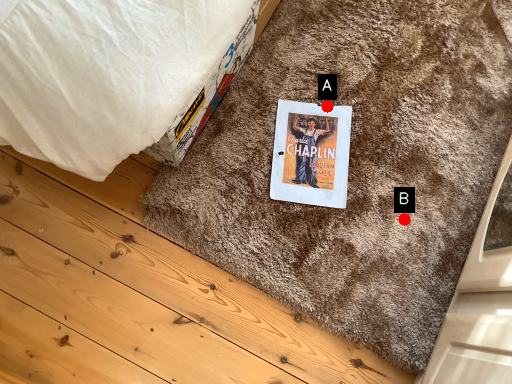
Question: Two points are circled on the image, labeled by A and B beside each circle. Among these points, which one is farthest from the camera?

Choices:
 (A) A is further
 (B) B is further

Answer: (A)